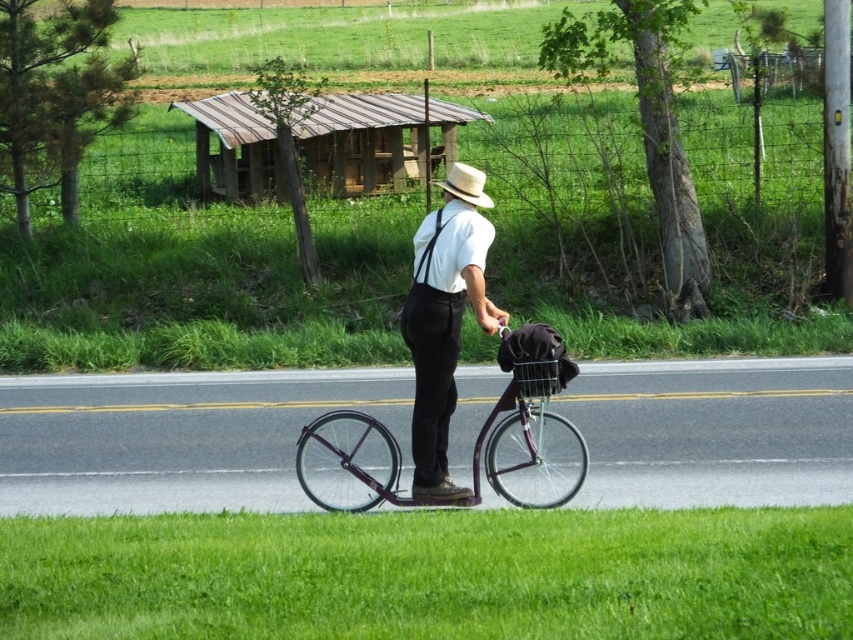
You are a photographer trying to capture the man in the scene. If you want to focus on the white matte shirt at center, where should you aim your camera? Please provide the coordinates in the format of a point like this example format for reference, but do not include any other details.

The white matte shirt at center is located at point [444,320]. Aim your camera there.

You are a photographer trying to capture the man in the scene. If you want to focus on the black fabric suspenders at center, where should you aim your camera? Please provide coordinates in the format of x,y where x is the horizontal axis from left to right and y is the vertical axis from bottom to top.

You should aim your camera at the coordinates (444, 248) to focus on the black fabric suspenders at center.